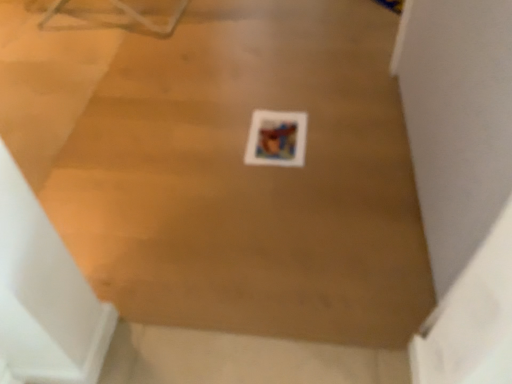
Question: Looking at their shapes, would you say matte paper print at center is wider or thinner than wooden floor at center?

Choices:
 (A) thin
 (B) wide

Answer: (A)

Question: Is matte paper print at center situated inside wooden floor at center or outside?

Choices:
 (A) outside
 (B) inside

Answer: (B)

Question: From a real-world perspective, is matte paper print at center physically located above or below wooden floor at center?

Choices:
 (A) above
 (B) below

Answer: (A)

Question: Is wooden floor at center bigger or smaller than matte paper print at center?

Choices:
 (A) small
 (B) big

Answer: (B)

Question: From a real-world perspective, is wooden floor at center positioned above or below matte paper print at center?

Choices:
 (A) above
 (B) below

Answer: (B)

Question: Is point (138, 92) closer or farther from the camera than point (293, 150)?

Choices:
 (A) farther
 (B) closer

Answer: (A)

Question: Is wooden floor at center to the left or to the right of matte paper print at center in the image?

Choices:
 (A) left
 (B) right

Answer: (A)